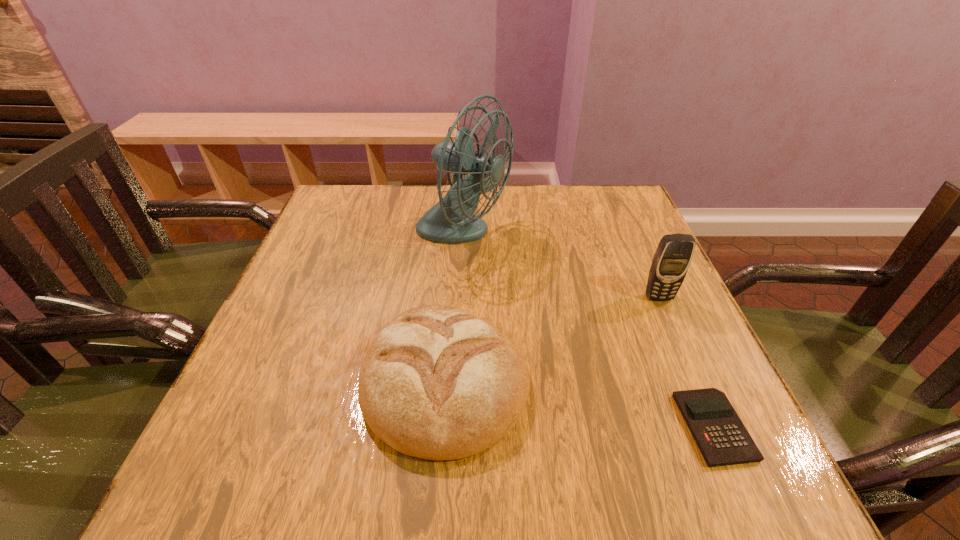
This screenshot has height=540, width=960. What are the coordinates of `the farthest object` in the screenshot? It's located at (450, 221).

I want to click on the tallest object, so click(x=450, y=221).

Locate an element on the screen. The height and width of the screenshot is (540, 960). the third shortest object is located at coordinates (673, 256).

The height and width of the screenshot is (540, 960). In order to click on the second farthest object in this screenshot , I will do `click(673, 256)`.

At what (x,y) coordinates should I click in order to perform the action: click on the third tallest object. Please return your answer as a coordinate pair (x, y). The width and height of the screenshot is (960, 540). Looking at the image, I should click on (438, 383).

The image size is (960, 540). I want to click on calculator, so click(722, 438).

Where is `free space located 0.090m in front of the tallest object to blow air`? free space located 0.090m in front of the tallest object to blow air is located at coordinates (547, 235).

The height and width of the screenshot is (540, 960). I want to click on free region located on the front face of the second farthest object, so click(x=670, y=323).

Locate an element on the screen. Image resolution: width=960 pixels, height=540 pixels. vacant space located on the back of the bread is located at coordinates (455, 247).

You are a GUI agent. You are given a task and a screenshot of the screen. Output one action in this format:
    pyautogui.click(x=<x>, y=<y>)
    Task: Click on the vacant space located on the left of the shortest object
    
    Given the screenshot: What is the action you would take?
    pyautogui.click(x=653, y=427)